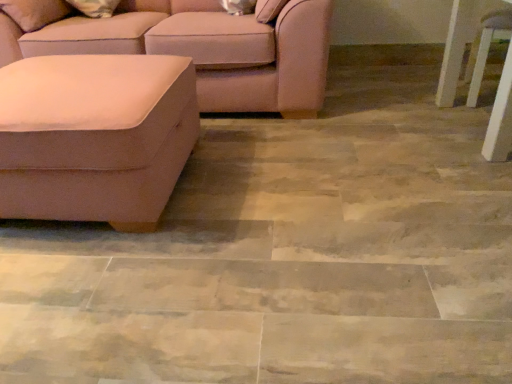
Question: Is point (315, 18) positioned closer to the camera than point (145, 110)?

Choices:
 (A) closer
 (B) farther

Answer: (B)

Question: Is suede-like beige couch at left, the 2th studio couch in the front-to-back sequence, to the left or to the right of suede-like beige ottoman at left, positioned as the 2th studio couch in back-to-front order, in the image?

Choices:
 (A) left
 (B) right

Answer: (B)

Question: Considering the real-world distances, which object is farthest from the white glossy side table at right?

Choices:
 (A) suede-like beige ottoman at left, which ranks as the 1th studio couch in front-to-back order
 (B) suede-like beige couch at left, the 2th studio couch in the front-to-back sequence

Answer: (A)

Question: Estimate the real-world distances between objects in this image. Which object is farther from the white glossy side table at right?

Choices:
 (A) suede-like beige couch at left, which is counted as the first studio couch, starting from the back
 (B) suede-like beige ottoman at left, which ranks as the 1th studio couch in front-to-back order

Answer: (B)